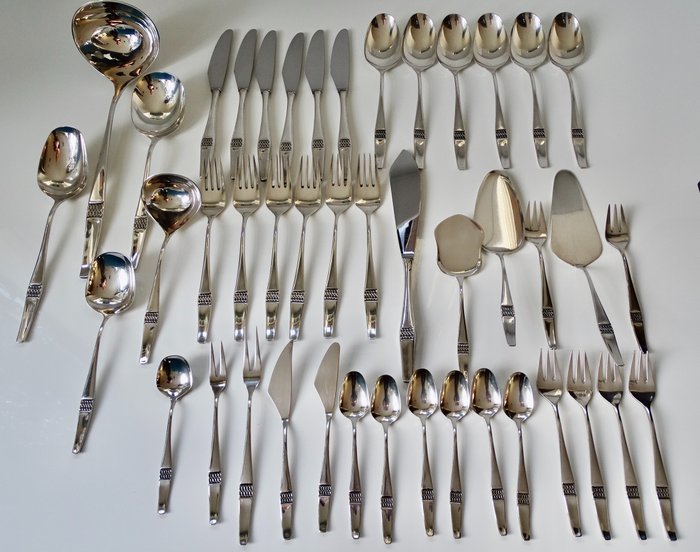
Locate an element on the screen. knives is located at coordinates (217, 75), (246, 72), (262, 76), (290, 76), (313, 76), (341, 78).